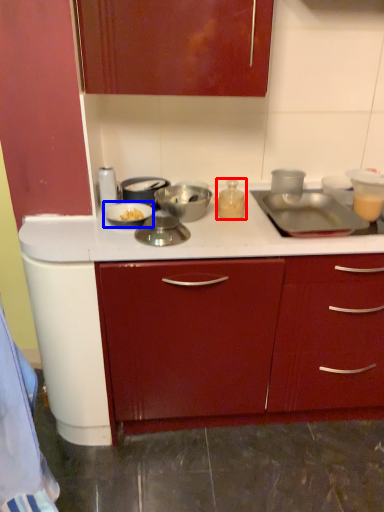
Question: Which of the following is the farthest to the observer, kitchen appliance (highlighted by a red box) or kitchen appliance (highlighted by a blue box)?

Choices:
 (A) kitchen appliance
 (B) kitchen appliance

Answer: (A)